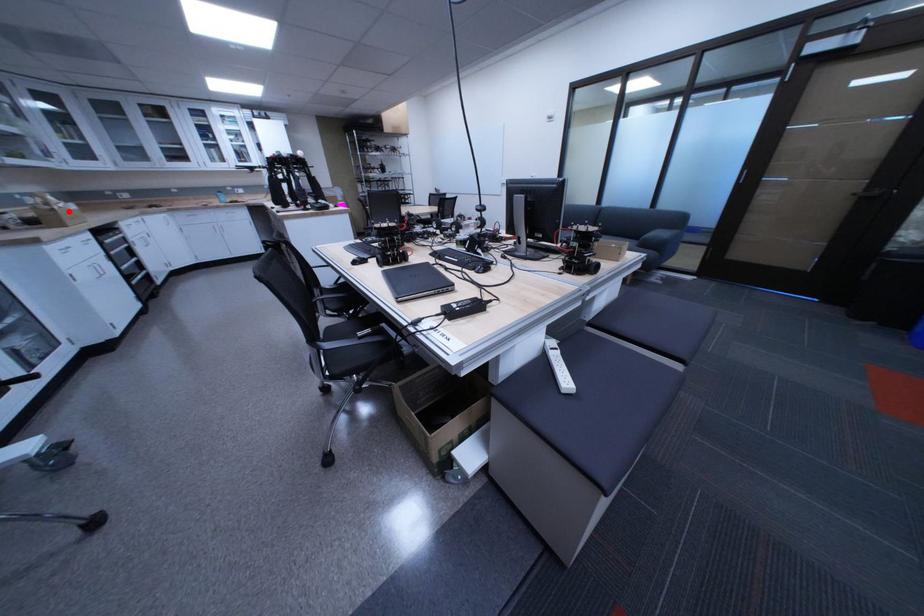
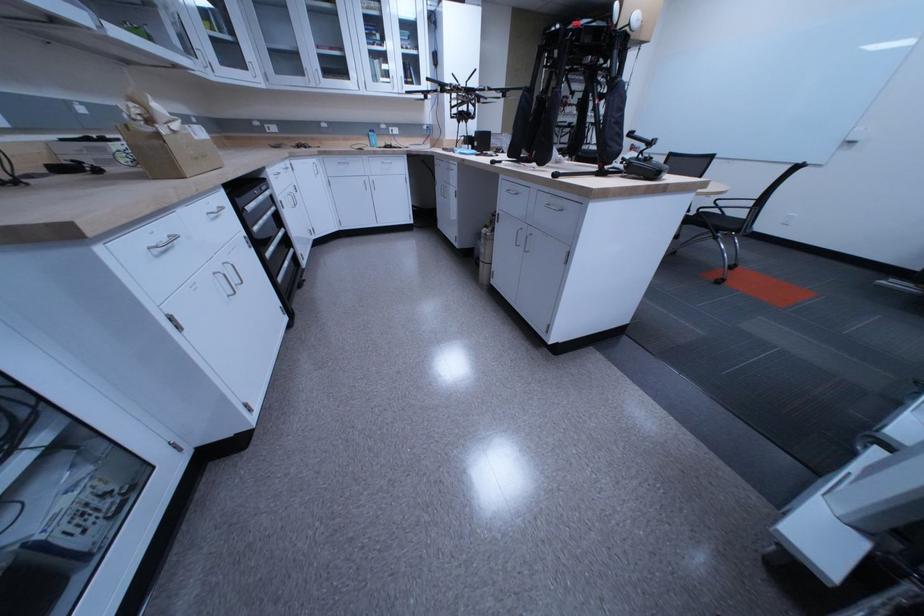
The point at the highlighted location is marked in the first image. Where is the corresponding point in the second image?

(174, 137)